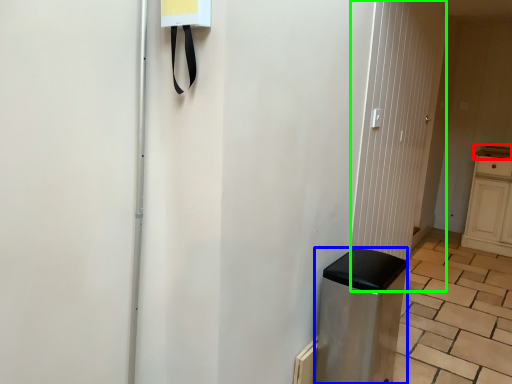
Question: Based on their relative distances, which object is nearer to counter top (highlighted by a red box)? Choose from appliance (highlighted by a blue box) and screen door (highlighted by a green box).

Choices:
 (A) appliance
 (B) screen door

Answer: (B)